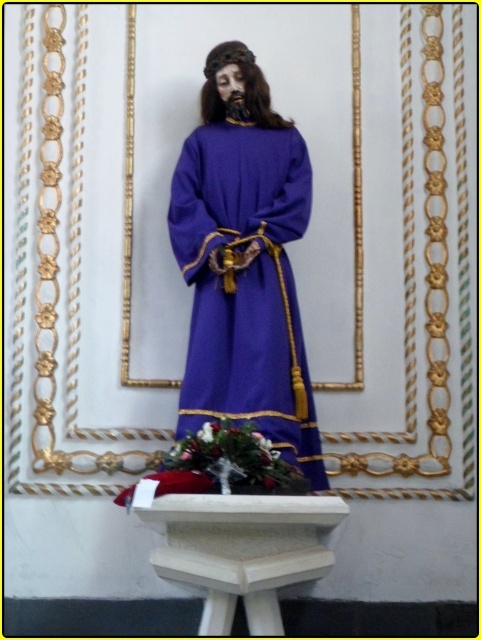
Question: Does purple woolen robe at center lie behind white wood altar at center?

Choices:
 (A) no
 (B) yes

Answer: (B)

Question: Can you confirm if purple woolen robe at center is positioned to the right of white wood altar at center?

Choices:
 (A) yes
 (B) no

Answer: (B)

Question: Which point is closer to the camera?

Choices:
 (A) (198, 264)
 (B) (265, 611)

Answer: (B)

Question: Can you confirm if purple woolen robe at center is thinner than white wood altar at center?

Choices:
 (A) no
 (B) yes

Answer: (B)

Question: Which object appears closest to the camera in this image?

Choices:
 (A) purple woolen robe at center
 (B) white wood altar at center

Answer: (B)